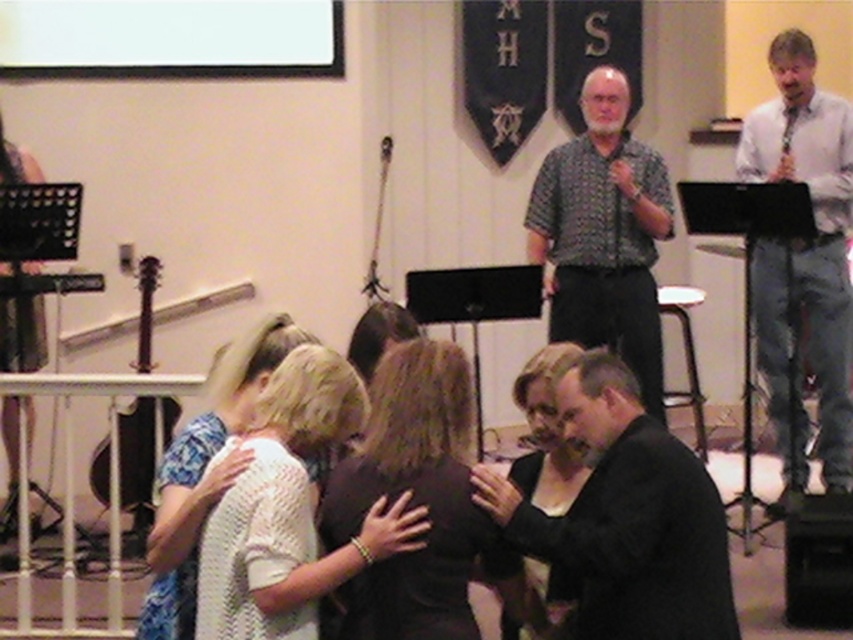
Question: Does dark brown fabric dress at center come behind black matte dress at center?

Choices:
 (A) yes
 (B) no

Answer: (B)

Question: Which point appears farthest from the camera in this image?

Choices:
 (A) (415, 618)
 (B) (566, 365)

Answer: (B)

Question: Which of the following is the closest to the observer?

Choices:
 (A) white shirt at upper right
 (B) white knitted sweater at center
 (C) black matte dress at center

Answer: (B)

Question: In this image, where is black matte suit at center located relative to white shirt at upper right?

Choices:
 (A) left
 (B) right

Answer: (A)

Question: Is dark brown fabric dress at center positioned in front of black matte dress at center?

Choices:
 (A) no
 (B) yes

Answer: (B)

Question: Which object appears farthest from the camera in this image?

Choices:
 (A) black wood guitar at left
 (B) black matte suit at center
 (C) white knitted sweater at center

Answer: (A)